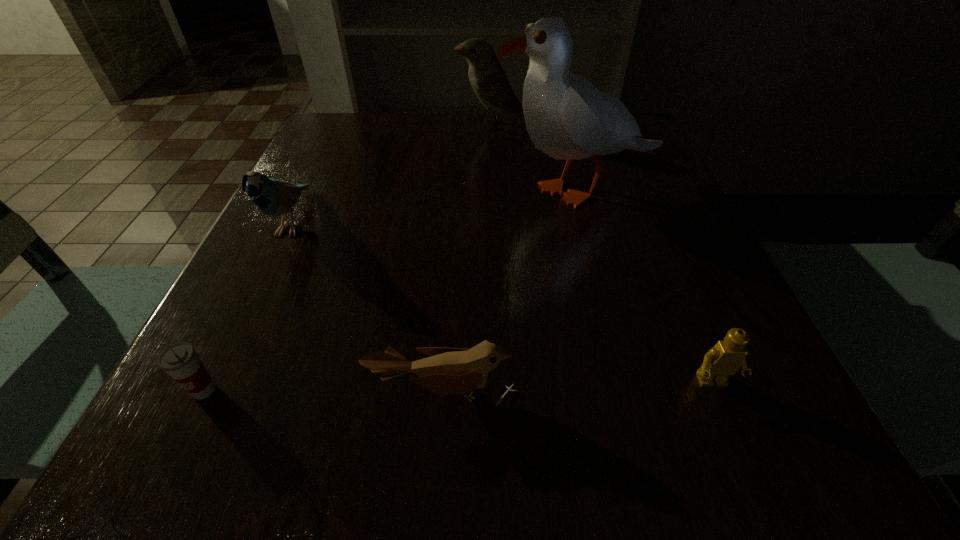
Identify the location of cup positioned at the left edge. (180, 360).

Find the location of a particular element. This screenshot has height=540, width=960. gull located in the right edge section of the desktop is located at coordinates (568, 118).

Image resolution: width=960 pixels, height=540 pixels. What are the coordinates of `Lego that is at the right edge` in the screenshot? It's located at (729, 356).

At what (x,y) coordinates should I click in order to perform the action: click on blank space at the far edge of the desktop. Please return your answer as a coordinate pair (x, y). Looking at the image, I should click on (483, 143).

Image resolution: width=960 pixels, height=540 pixels. In order to click on blank area at the left edge in this screenshot , I will do [340, 205].

Image resolution: width=960 pixels, height=540 pixels. Identify the location of vacant area at the right edge. (704, 276).

Where is `free space at the far left corner of the desktop`? free space at the far left corner of the desktop is located at coordinates (338, 123).

Find the location of a particular element. This screenshot has width=960, height=540. free spot at the near left corner of the desktop is located at coordinates (149, 456).

Locate an element on the screen. The height and width of the screenshot is (540, 960). vacant area that lies between the cup and the farthest bird is located at coordinates (348, 258).

This screenshot has height=540, width=960. What are the coordinates of `free point between the fourth shortest object and the cup` in the screenshot? It's located at (249, 306).